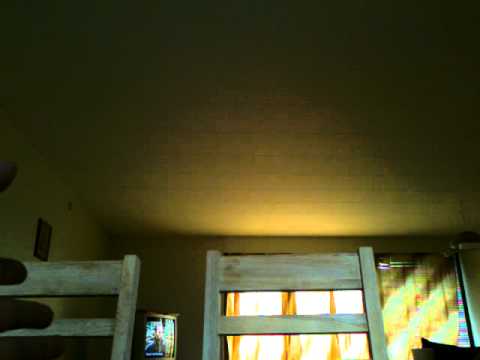
The height and width of the screenshot is (360, 480). In order to click on light source in this screenshot , I will do `click(264, 303)`.